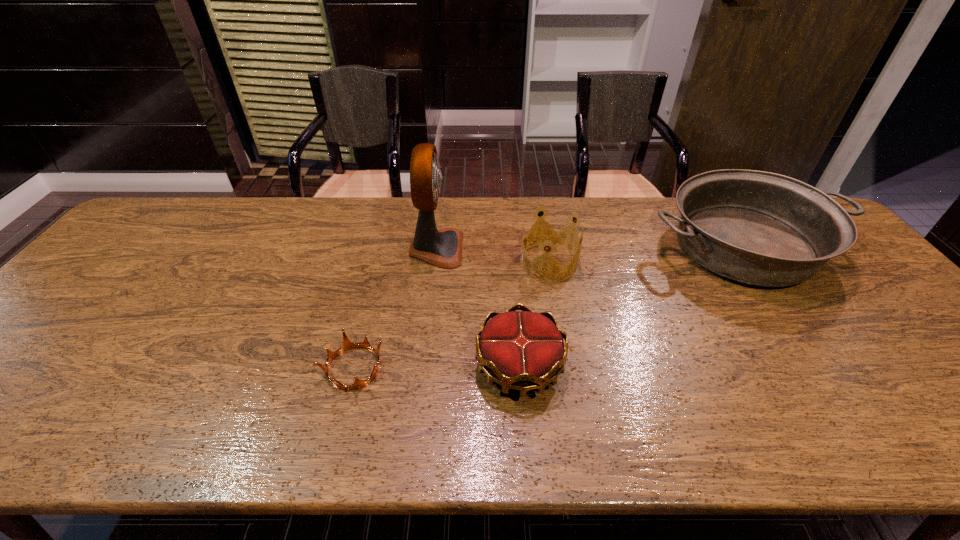
At what (x,y) coordinates should I click in order to perform the action: click on vacant area between the shortest object and the tallest object. Please return your answer as a coordinate pair (x, y). This screenshot has width=960, height=540. Looking at the image, I should click on (396, 308).

I want to click on empty space that is in between the second shortest crown and the fan, so click(478, 308).

You are a GUI agent. You are given a task and a screenshot of the screen. Output one action in this format:
    pyautogui.click(x=<x>, y=<y>)
    Task: Click on the vacant point located between the rightmost object and the fourth tallest object
    Image resolution: width=960 pixels, height=540 pixels.
    Given the screenshot: What is the action you would take?
    pyautogui.click(x=632, y=307)

The width and height of the screenshot is (960, 540). I want to click on vacant space in between the second shortest crown and the fan, so click(x=478, y=308).

Locate an element on the screen. The width and height of the screenshot is (960, 540). blank region between the second object from left to right and the leftmost object is located at coordinates (396, 308).

Where is `unoccupied area between the second shortest crown and the pan`? unoccupied area between the second shortest crown and the pan is located at coordinates (632, 307).

Find the location of `unoccupied area between the farthest crown and the rightmost object`. unoccupied area between the farthest crown and the rightmost object is located at coordinates (646, 255).

The width and height of the screenshot is (960, 540). In order to click on vacant space that's between the pan and the fourth tallest object in this screenshot , I will do `click(632, 307)`.

At what (x,y) coordinates should I click in order to perform the action: click on free spot between the shortest object and the farthest crown. Please return your answer as a coordinate pair (x, y). Looking at the image, I should click on (451, 315).

Point out which object is positioned as the second nearest to the rightmost object. Please provide its 2D coordinates. Your answer should be formatted as a tuple, i.e. [(x, y)], where the tuple contains the x and y coordinates of a point satisfying the conditions above.

[(524, 350)]